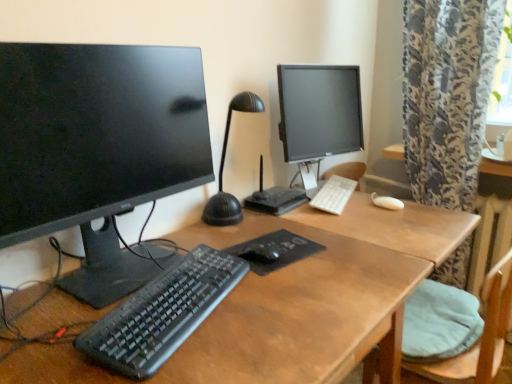
Identify the location of free space in front of black matte mouse at center. Image resolution: width=512 pixels, height=384 pixels. (268, 289).